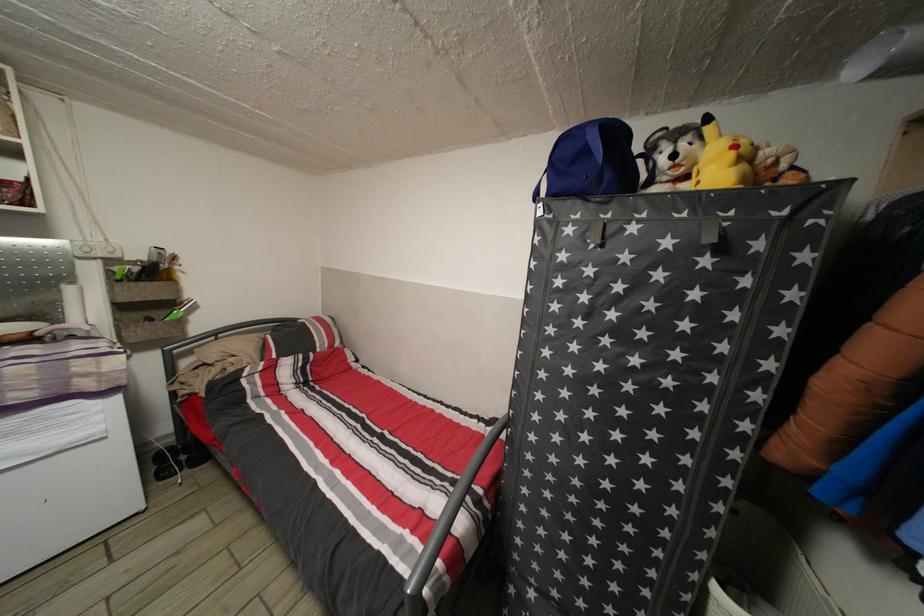
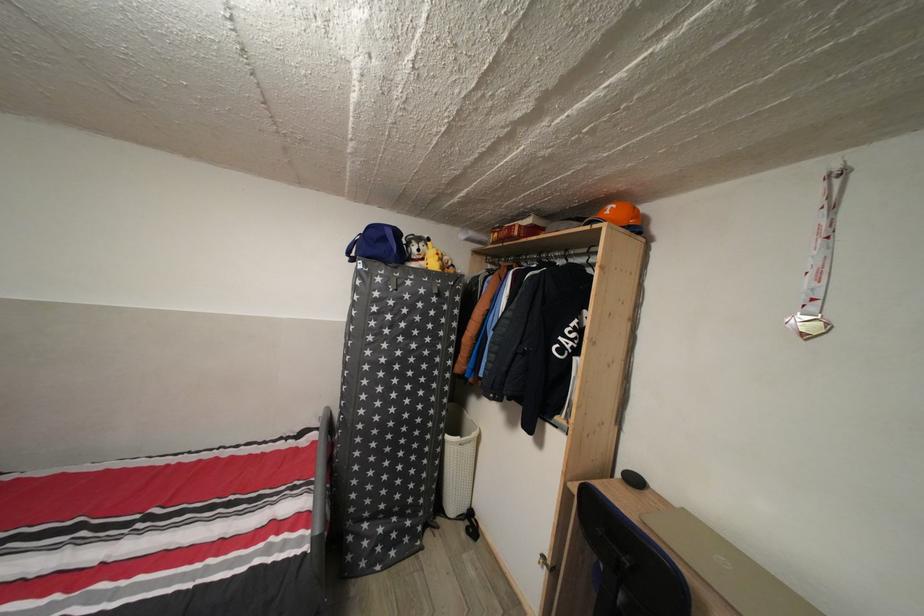
Find the pixel in the second image that matches point 591,158 in the first image.

(391, 246)